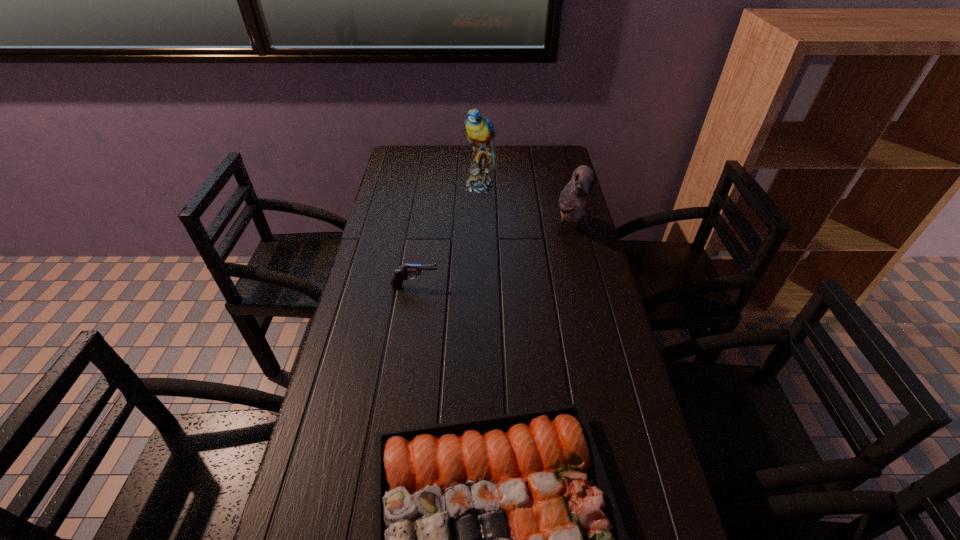
Locate an element on the screen. The width and height of the screenshot is (960, 540). the farthest object is located at coordinates (480, 132).

The height and width of the screenshot is (540, 960). I want to click on the farther parrot, so click(x=480, y=132).

Locate an element on the screen. the second farthest object is located at coordinates (576, 198).

Where is `the second tallest object`? Image resolution: width=960 pixels, height=540 pixels. the second tallest object is located at coordinates (576, 198).

I want to click on the third farthest object, so click(x=401, y=274).

Where is `pistol`? pistol is located at coordinates pos(401,274).

Image resolution: width=960 pixels, height=540 pixels. I want to click on vacant space located 0.140m on the face of the farther parrot, so click(x=479, y=219).

This screenshot has width=960, height=540. What are the coordinates of `free space located on the front-facing side of the third shortest object` in the screenshot? It's located at (599, 358).

You are a GUI agent. You are given a task and a screenshot of the screen. Output one action in this format:
    pyautogui.click(x=<x>, y=<y>)
    Task: Click on the free space located at the barrel of the second nearest object
    The height and width of the screenshot is (540, 960).
    Given the screenshot: What is the action you would take?
    pyautogui.click(x=566, y=286)

Where is `object positioned at the far edge`? The image size is (960, 540). object positioned at the far edge is located at coordinates (480, 132).